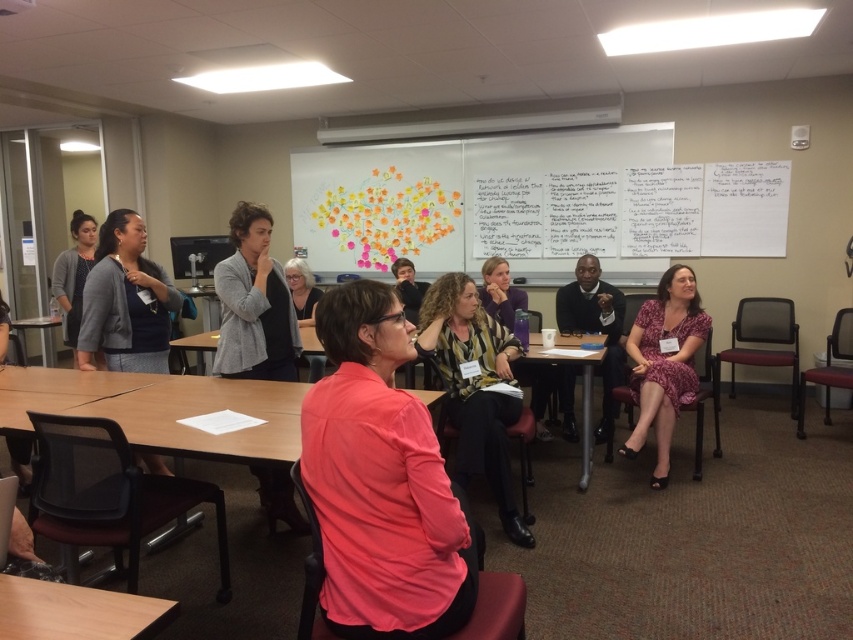
Question: Among these objects, which one is nearest to the camera?

Choices:
 (A) wooden table at lower left
 (B) patterned fabric blouse at center

Answer: (A)

Question: Is purple floral dress at lower right below white matte hair at center?

Choices:
 (A) no
 (B) yes

Answer: (B)

Question: Which object appears farthest from the camera in this image?

Choices:
 (A) smooth wooden table at center
 (B) wooden table at left

Answer: (B)

Question: Estimate the real-world distances between objects in this image. Which object is closer to the matte gray cardigan at left?

Choices:
 (A) smooth wooden table at center
 (B) white matte hair at center
 (C) striped fabric shirt at center
 (D) whiteboard at upper center

Answer: (B)

Question: Does purple floral dress at lower right have a smaller size compared to white matte hair at center?

Choices:
 (A) no
 (B) yes

Answer: (A)

Question: Can you confirm if matte gray sweater at left is smaller than purple floral dress at lower right?

Choices:
 (A) yes
 (B) no

Answer: (A)